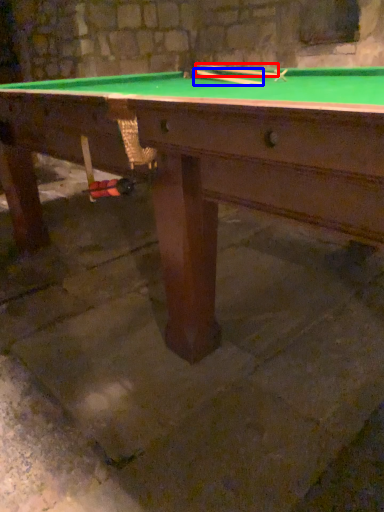
Question: Which object appears farthest to the camera in this image, cue (highlighted by a red box) or cue (highlighted by a blue box)?

Choices:
 (A) cue
 (B) cue

Answer: (A)